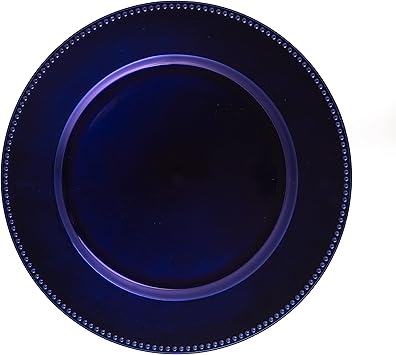
Find the location of a particular element. This screenshot has height=355, width=396. southernmost portion of charger plate is located at coordinates (170, 351).